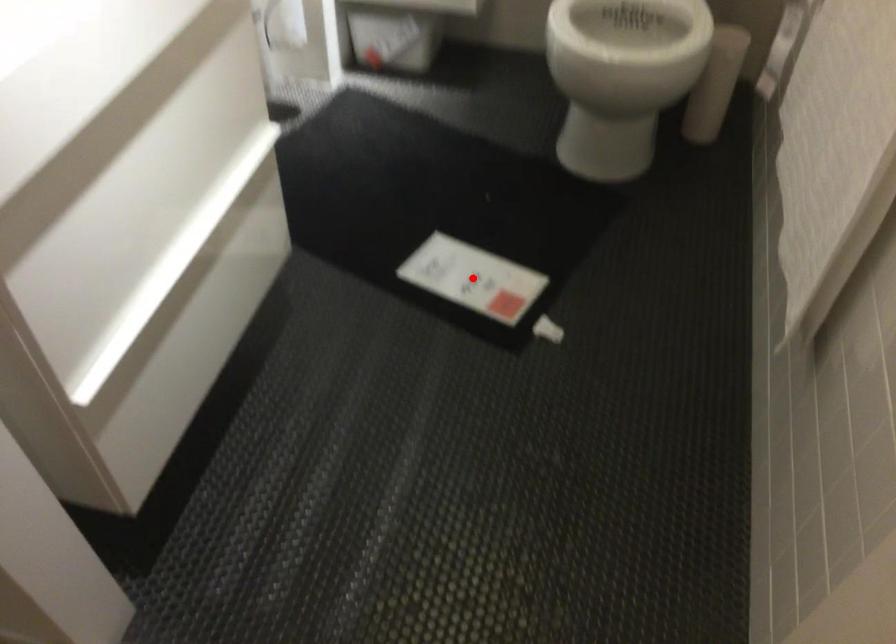
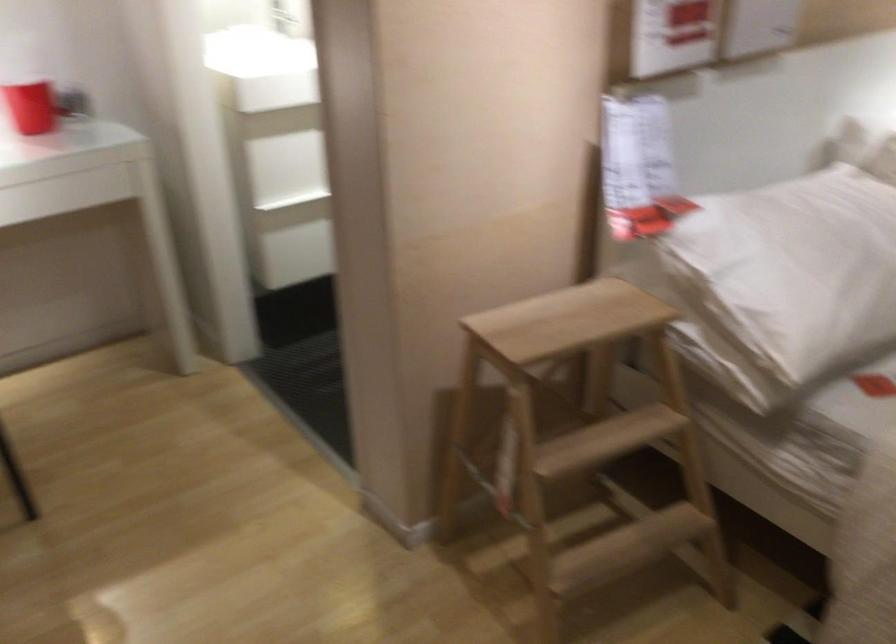
Question: I am providing you with two images of the same scene from different viewpoints. A red point is marked on the first image. At the location where the point appears in image 1, is it still visible in image 2?

Choices:
 (A) Yes
 (B) No

Answer: (B)